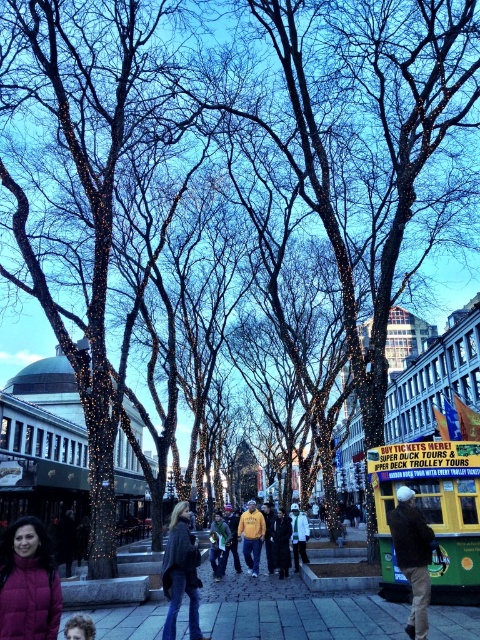
You are standing at the point marked as point (245, 528) in the image. You want to take a photo of the distant dome building. The camera you are using has a maximum zoom range of 100 feet. Will you be able to capture the entire dome building in your photo without moving from your current position?

The point (245, 528) and camera are 307.54 feet apart. Since the camera has a maximum zoom range of 100 feet, you will not be able to capture the entire dome building in your photo without moving closer.

You are a photographer trying to capture a photo of the dome building in the distance. You notice two jackets in the foreground, a dark brown leather jacket at center and a green fabric jacket at center. Which jacket is shorter and might not block the view of the dome building?

The dark brown leather jacket at center is shorter than the green fabric jacket at center, so it might not block the view of the dome building as much.

You are standing at the center of the plaza and want to walk to the dark gray stone pavement at lower left. Which direction should you walk to reach the point at coordinates point (x=292, y=611)?

The point at coordinates point (x=292, y=611) is located on the dark gray stone pavement at lower left, so you should walk towards the lower left direction to reach it.